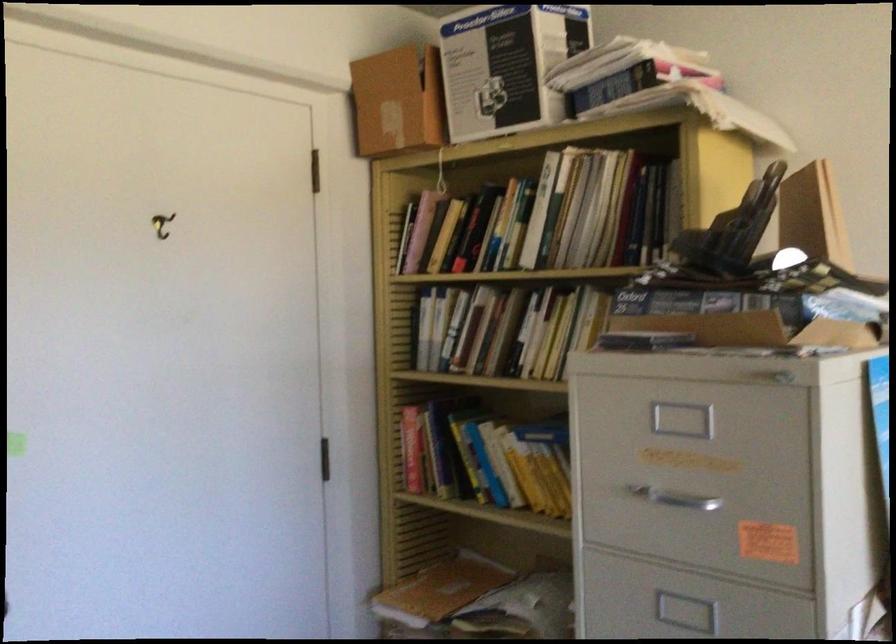
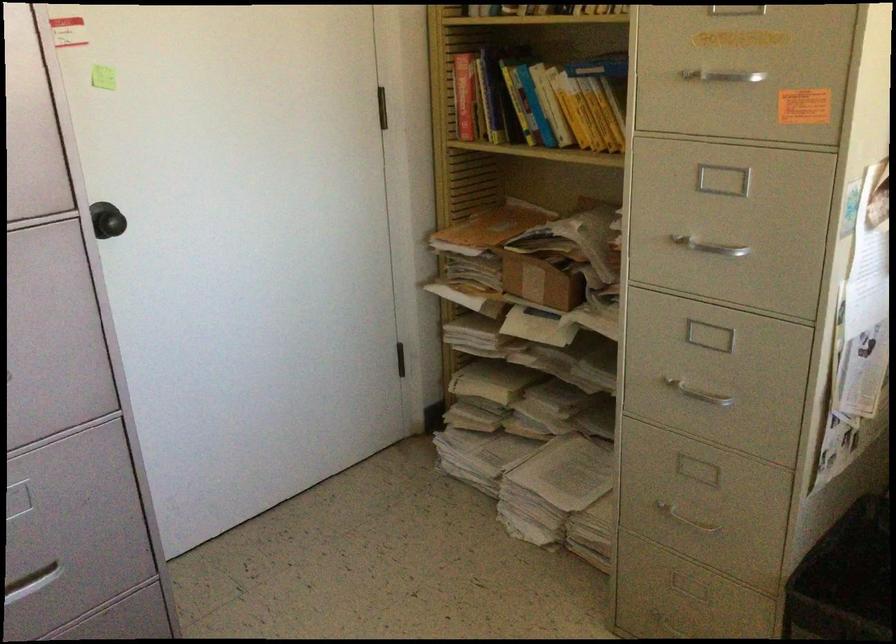
The point at [411,451] is marked in the first image. Where is the corresponding point in the second image?

(464, 96)